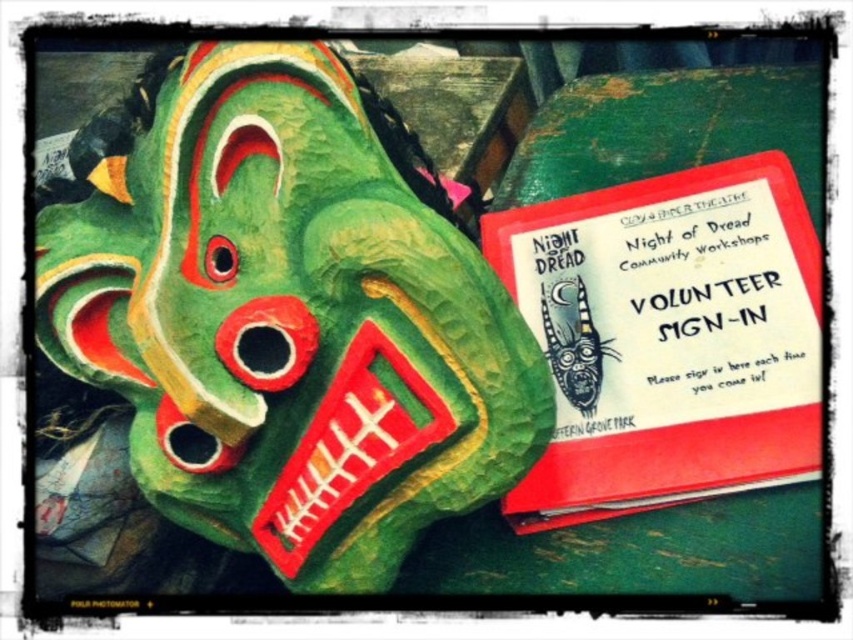
Question: Is red paper volunteer sign-in at right above green papier-mâché dragon at center?

Choices:
 (A) no
 (B) yes

Answer: (B)

Question: Among these objects, which one is nearest to the camera?

Choices:
 (A) red paper volunteer sign-in at right
 (B) green papier-mâché dragon at center
 (C) green papier-mâché mask at left

Answer: (C)

Question: Estimate the real-world distances between objects in this image. Which object is farther from the green papier-mâché mask at left?

Choices:
 (A) red paper volunteer sign-in at right
 (B) green papier-mâché dragon at center

Answer: (B)

Question: Is green papier-mâché mask at left thinner than red paper volunteer sign-in at right?

Choices:
 (A) yes
 (B) no

Answer: (B)

Question: Which of these objects is positioned farthest from the green papier-mâché dragon at center?

Choices:
 (A) green papier-mâché mask at left
 (B) red paper volunteer sign-in at right

Answer: (A)

Question: Does green papier-mâché mask at left appear under red paper volunteer sign-in at right?

Choices:
 (A) yes
 (B) no

Answer: (B)